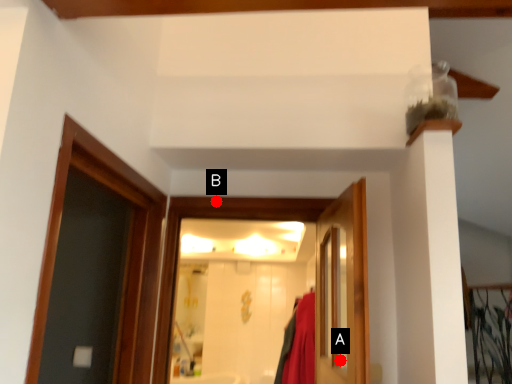
Question: Two points are circled on the image, labeled by A and B beside each circle. Which point appears closest to the camera in this image?

Choices:
 (A) A is closer
 (B) B is closer

Answer: (A)